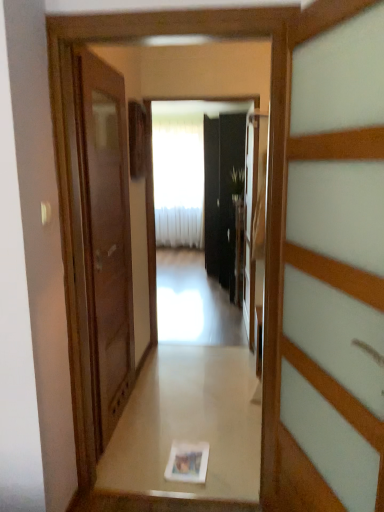
Find the location of a particular element. vacant area situated to the left side of glossy black mirror at center is located at coordinates (169, 351).